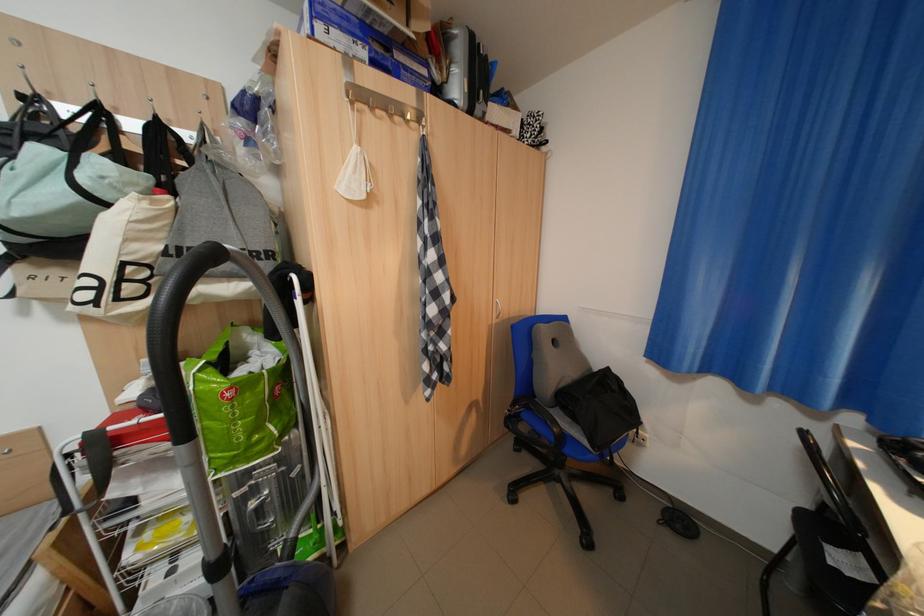
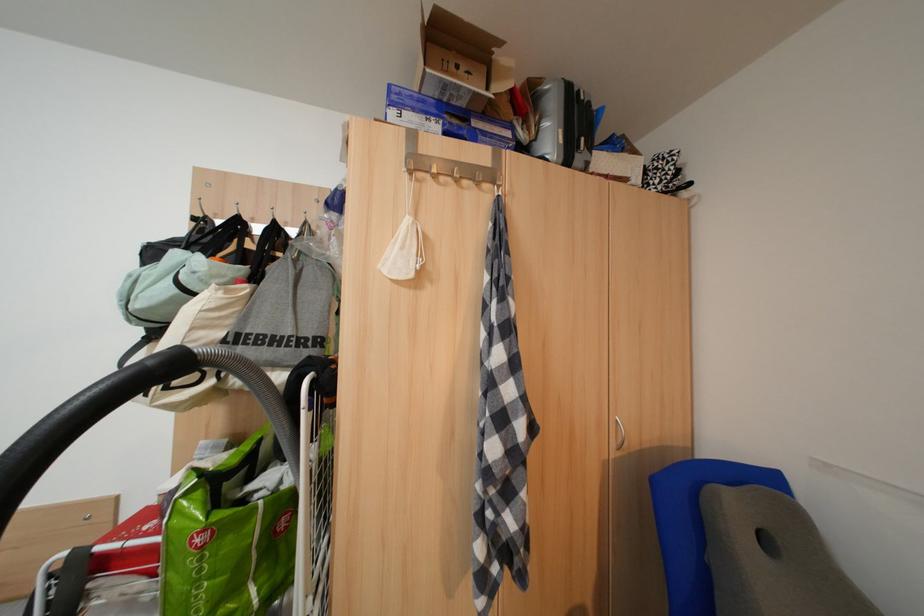
Find the pixel in the second image that matches [261,439] in the first image.

(225, 610)